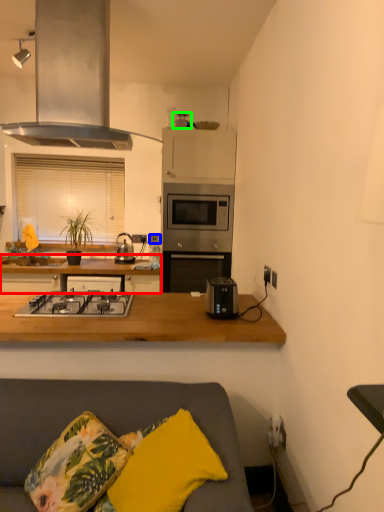
Question: Estimate the real-world distances between objects in this image. Which object is closer to countertop (highlighted by a red box), electric outlet (highlighted by a blue box) or appliance (highlighted by a green box)?

Choices:
 (A) electric outlet
 (B) appliance

Answer: (A)